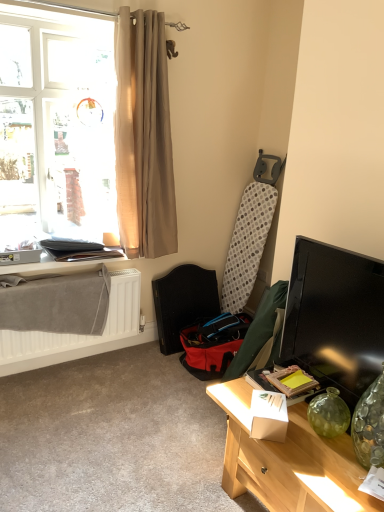
The width and height of the screenshot is (384, 512). What do you see at coordinates (65, 262) in the screenshot? I see `matte black table at lower left` at bounding box center [65, 262].

Image resolution: width=384 pixels, height=512 pixels. I want to click on white matte radiator at lower left, so click(76, 334).

Image resolution: width=384 pixels, height=512 pixels. What are the coordinates of `light wood desk at lower right` in the screenshot? It's located at (288, 460).

Find the location of a particular element. beige fabric curtain at upper left is located at coordinates (143, 137).

The width and height of the screenshot is (384, 512). What do you see at coordinates (183, 303) in the screenshot?
I see `red fabric folding chair at center` at bounding box center [183, 303].

At what (x,y) coordinates should I click in order to perform the action: click on black glossy tv at right. Please return your answer as a coordinate pair (x, y). Looking at the image, I should click on (335, 317).

From the image's perspective, is matte black table at lower left under light wood desk at lower right?

Incorrect, from the image's perspective, matte black table at lower left is higher than light wood desk at lower right.

Is matte black table at lower left in front of light wood desk at lower right?

No, it is not.

Based on the photo, which object is positioned more to the left, matte black table at lower left or light wood desk at lower right?

matte black table at lower left.

Considering the sizes of objects matte black table at lower left and light wood desk at lower right in the image provided, who is wider, matte black table at lower left or light wood desk at lower right?

Wider between the two is light wood desk at lower right.

From a real-world perspective, who is located lower, beige fabric curtain at upper left or white matte radiator at lower left?

white matte radiator at lower left is physically lower.

Could you tell me if beige fabric curtain at upper left is turned towards white matte radiator at lower left?

No, beige fabric curtain at upper left is not turned towards white matte radiator at lower left.

Which object is closer to the camera taking this photo, beige fabric curtain at upper left or white matte radiator at lower left?

beige fabric curtain at upper left is more forward.

How many degrees apart are the facing directions of translucent fabric window at upper left and white matte radiator at lower left?

They differ by 0.654 degrees in their facing directions.

Which object is closer to the camera, translucent fabric window at upper left or white matte radiator at lower left?

translucent fabric window at upper left is closer to the camera.

From the image's perspective, between translucent fabric window at upper left and white matte radiator at lower left, who is located below?

white matte radiator at lower left is shown below in the image.

Is translucent fabric window at upper left positioned beyond the bounds of white matte radiator at lower left?

Yes, translucent fabric window at upper left is outside of white matte radiator at lower left.

Is black glossy tv at right positioned beyond the bounds of light wood desk at lower right?

Absolutely, black glossy tv at right is external to light wood desk at lower right.

Is black glossy tv at right bigger than light wood desk at lower right?

No.

From a real-world perspective, who is located higher, black glossy tv at right or light wood desk at lower right?

In real-world perspective, black glossy tv at right is above.

Considering the relative sizes of black glossy tv at right and light wood desk at lower right in the image provided, is black glossy tv at right wider than light wood desk at lower right?

No, black glossy tv at right is not wider than light wood desk at lower right.

From a real-world perspective, is matte black table at lower left physically above translucent fabric window at upper left?

No, from a real-world perspective, matte black table at lower left is not on top of translucent fabric window at upper left.

Is matte black table at lower left positioned far away from translucent fabric window at upper left?

No, matte black table at lower left is in close proximity to translucent fabric window at upper left.

Is matte black table at lower left spatially inside translucent fabric window at upper left, or outside of it?

matte black table at lower left is enclosed within translucent fabric window at upper left.

How many degrees apart are the facing directions of matte black table at lower left and translucent fabric window at upper left?

The facing directions of matte black table at lower left and translucent fabric window at upper left are 0.171 degrees apart.

Which object is further away from the camera taking this photo, translucent fabric window at upper left or beige fabric curtain at upper left?

beige fabric curtain at upper left is more distant.

From the picture: Does translucent fabric window at upper left turn towards beige fabric curtain at upper left?

Yes, translucent fabric window at upper left is aimed at beige fabric curtain at upper left.

Measure the distance from translucent fabric window at upper left to beige fabric curtain at upper left.

7.08 inches.

Can you confirm if translucent fabric window at upper left is smaller than beige fabric curtain at upper left?

No, translucent fabric window at upper left is not smaller than beige fabric curtain at upper left.

Which of these two, light wood desk at lower right or beige fabric curtain at upper left, is thinner?

beige fabric curtain at upper left.

From a real-world perspective, who is located lower, light wood desk at lower right or beige fabric curtain at upper left?

light wood desk at lower right.

Is light wood desk at lower right directly adjacent to beige fabric curtain at upper left?

light wood desk at lower right and beige fabric curtain at upper left are clearly separated.

This screenshot has width=384, height=512. I want to click on desk in front of the matte black table at lower left, so click(288, 460).

The height and width of the screenshot is (512, 384). Identify the location of radiator below the beige fabric curtain at upper left (from a real-world perspective). (76, 334).

Looking at the image, which one is located further to red fabric folding chair at center, white matte radiator at lower left or black glossy tv at right?

black glossy tv at right.

Considering their positions, is matte black table at lower left positioned further to light wood desk at lower right than white matte radiator at lower left?

Based on the image, matte black table at lower left appears to be further to light wood desk at lower right.

Based on their spatial positions, is white matte radiator at lower left or black glossy tv at right closer to beige fabric curtain at upper left?

white matte radiator at lower left.

When comparing their distances from beige fabric curtain at upper left, does translucent fabric window at upper left or matte black table at lower left seem closer?

translucent fabric window at upper left is positioned closer to the anchor beige fabric curtain at upper left.

Looking at the image, which one is located further to red fabric folding chair at center, matte black table at lower left or translucent fabric window at upper left?

Based on the image, translucent fabric window at upper left appears to be further to red fabric folding chair at center.

Looking at this image, based on their spatial positions, is white matte radiator at lower left or red fabric folding chair at center closer to light wood desk at lower right?

red fabric folding chair at center is closer to light wood desk at lower right.

Consider the image. Based on their spatial positions, is black glossy tv at right or translucent fabric window at upper left closer to red fabric folding chair at center?

translucent fabric window at upper left.

Looking at the image, which one is located closer to light wood desk at lower right, beige fabric curtain at upper left or matte black table at lower left?

Based on the image, matte black table at lower left appears to be nearer to light wood desk at lower right.

Identify the location of table between translucent fabric window at upper left and red fabric folding chair at center from top to bottom. Image resolution: width=384 pixels, height=512 pixels. (65, 262).

You are a GUI agent. You are given a task and a screenshot of the screen. Output one action in this format:
    pyautogui.click(x=<x>, y=<y>)
    Task: Click on the television between beige fabric curtain at upper left and light wood desk at lower right in the vertical direction
    This screenshot has width=384, height=512.
    Given the screenshot: What is the action you would take?
    pos(335,317)

Where is `radiator between light wood desk at lower right and red fabric folding chair at center from front to back`? The width and height of the screenshot is (384, 512). radiator between light wood desk at lower right and red fabric folding chair at center from front to back is located at coordinates 76,334.

Identify the location of curtain that lies between translucent fabric window at upper left and white matte radiator at lower left from top to bottom. Image resolution: width=384 pixels, height=512 pixels. (143, 137).